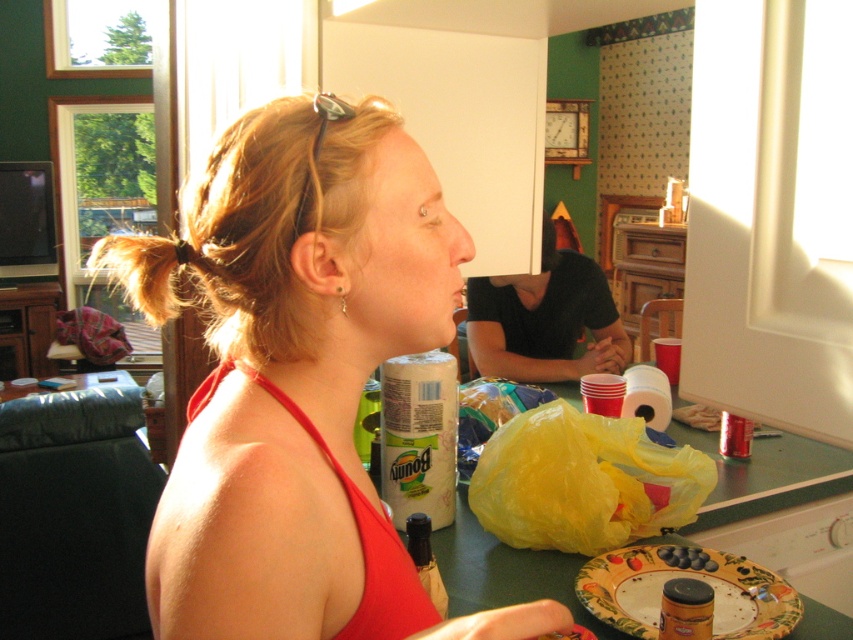
Question: Which point is farther to the camera?

Choices:
 (A) brown matte jar at lower right
 (B) red fabric bikini top at upper left
 (C) blonde hair at upper left

Answer: (A)

Question: Is matte red bikini top at center thinner than red fabric bikini top at upper left?

Choices:
 (A) no
 (B) yes

Answer: (A)

Question: Which point is closer to the camera?

Choices:
 (A) white paper towel at center
 (B) blonde hair at upper left
 (C) brown matte jar at lower right

Answer: (B)

Question: From the image, what is the correct spatial relationship of decorative ceramic plate with fruit design at lower right in relation to brown matte jar at lower right?

Choices:
 (A) right
 (B) left

Answer: (A)

Question: Can you confirm if white paper towel at center is positioned to the right of blonde hair at upper left?

Choices:
 (A) yes
 (B) no

Answer: (A)

Question: Which object appears farthest from the camera in this image?

Choices:
 (A) white paper towel at center
 (B) matte red bikini top at center
 (C) decorative ceramic plate with fruit design at lower right
 (D) brown matte jar at lower right

Answer: (A)